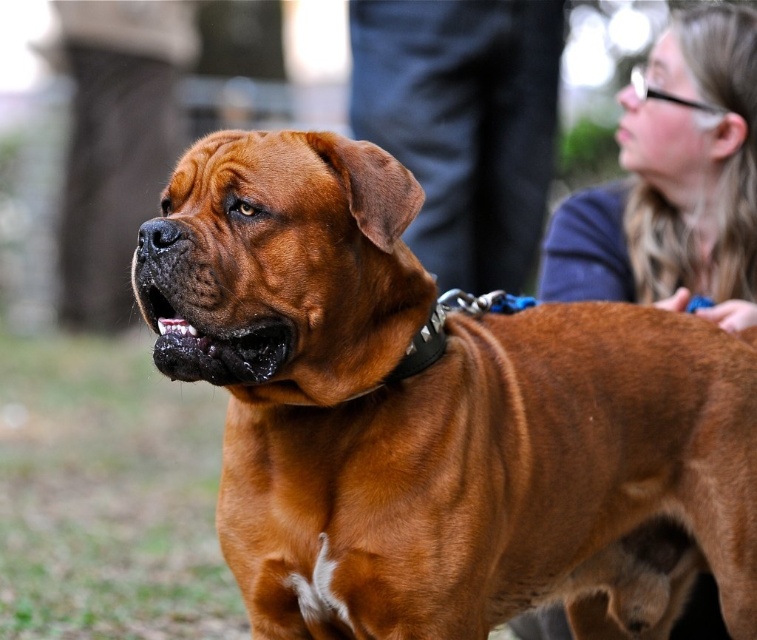
The width and height of the screenshot is (757, 640). What do you see at coordinates (435, 416) in the screenshot?
I see `brown leather dog at center` at bounding box center [435, 416].

Can you confirm if brown leather dog at center is positioned to the right of smooth blue shirt at upper right?

No, brown leather dog at center is not to the right of smooth blue shirt at upper right.

Is point (385, 208) in front of point (631, 272)?

Yes, point (385, 208) is closer to viewer.

Image resolution: width=757 pixels, height=640 pixels. Identify the location of brown leather dog at center. (435, 416).